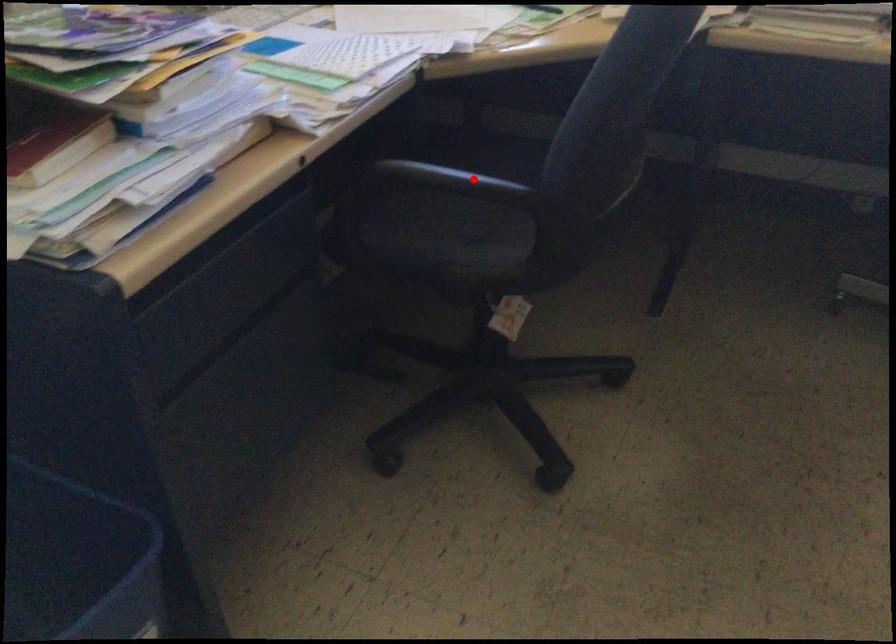
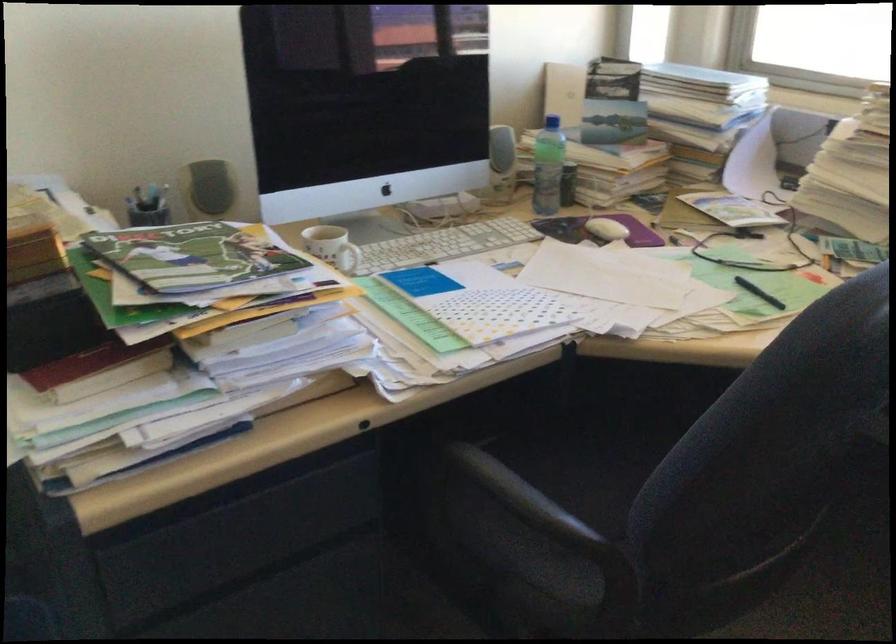
Question: I am providing you with two images of the same scene from different viewpoints. A red point is shown in image1. For the corresponding object point in image2, is it positioned nearer or farther from the camera?

Choices:
 (A) Nearer
 (B) Farther

Answer: (A)